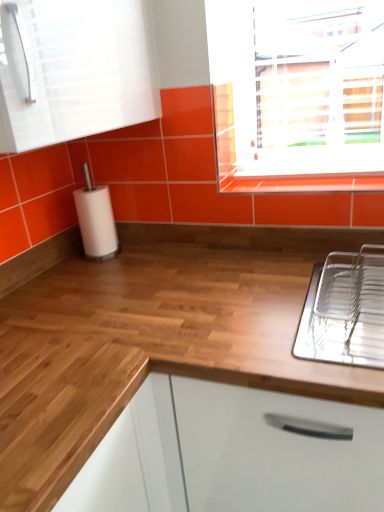
Question: From a real-world perspective, does white glossy cabinet at upper left sit lower than wooden at center?

Choices:
 (A) yes
 (B) no

Answer: (B)

Question: Is the position of white glossy cabinet at upper left more distant than that of wooden at center?

Choices:
 (A) yes
 (B) no

Answer: (B)

Question: Can you confirm if white glossy cabinet at upper left is smaller than wooden at center?

Choices:
 (A) yes
 (B) no

Answer: (A)

Question: Is white glossy cabinet at upper left wider than wooden at center?

Choices:
 (A) no
 (B) yes

Answer: (A)

Question: From the image's perspective, is white glossy cabinet at upper left on top of wooden at center?

Choices:
 (A) yes
 (B) no

Answer: (A)

Question: From the image's perspective, is white glossy cabinet at upper left below wooden at center?

Choices:
 (A) yes
 (B) no

Answer: (B)

Question: From the image's perspective, does wooden at center appear higher than white glossy cabinet at upper left?

Choices:
 (A) yes
 (B) no

Answer: (B)

Question: Is white glossy cabinet at upper left a part of wooden at center?

Choices:
 (A) yes
 (B) no

Answer: (B)

Question: Considering the relative sizes of wooden at center and white glossy cabinet at upper left in the image provided, is wooden at center wider than white glossy cabinet at upper left?

Choices:
 (A) no
 (B) yes

Answer: (B)

Question: Is wooden at center outside of white glossy cabinet at upper left?

Choices:
 (A) no
 (B) yes

Answer: (B)

Question: Is wooden at center shorter than white glossy cabinet at upper left?

Choices:
 (A) no
 (B) yes

Answer: (A)

Question: Would you say wooden at center is a long distance from white glossy cabinet at upper left?

Choices:
 (A) no
 (B) yes

Answer: (A)

Question: From a real-world perspective, is white matte paper towel at left positioned under clear plastic dish rack at right based on gravity?

Choices:
 (A) yes
 (B) no

Answer: (B)